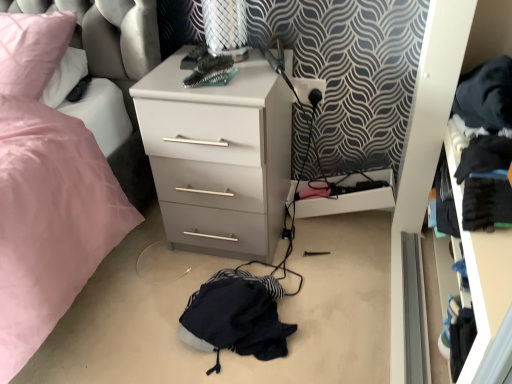
This screenshot has width=512, height=384. What are the coordinates of `free spot to the left of black fabric drawer at right` in the screenshot? It's located at (351, 316).